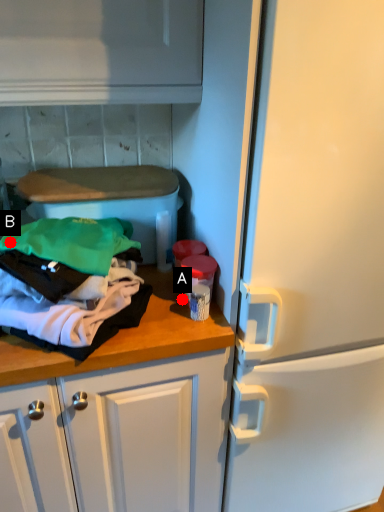
Question: Two points are circled on the image, labeled by A and B beside each circle. Which point is further to the camera?

Choices:
 (A) A is further
 (B) B is further

Answer: (A)